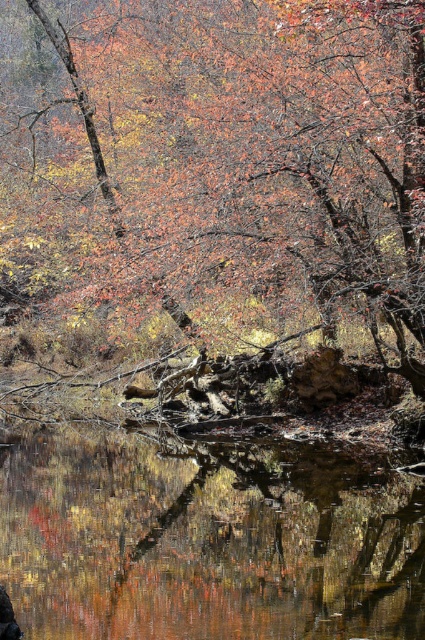
Question: Is autumn leaves at center further to camera compared to transparent water at center?

Choices:
 (A) no
 (B) yes

Answer: (B)

Question: Does autumn leaves at center have a smaller size compared to transparent water at center?

Choices:
 (A) no
 (B) yes

Answer: (A)

Question: Which object appears closest to the camera in this image?

Choices:
 (A) transparent water at center
 (B) autumn leaves at center

Answer: (A)

Question: From the image, what is the correct spatial relationship of autumn leaves at center in relation to transparent water at center?

Choices:
 (A) below
 (B) above

Answer: (B)

Question: Which point is closer to the camera?

Choices:
 (A) transparent water at center
 (B) autumn leaves at center

Answer: (A)